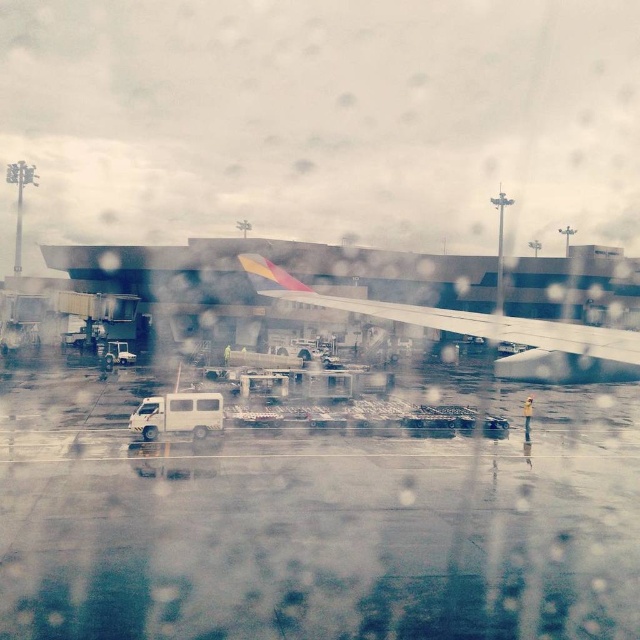
Does point (596, 352) lie in front of point (184, 408)?

That is True.

Can you confirm if metallic silver wing at center is thinner than transparent glass airplane window at center?

No.

Between point (481, 323) and point (184, 404), which one is positioned in front?

Point (481, 323)

Locate an element on the screen. metallic silver wing at center is located at coordinates (483, 332).

Which of these two, white matte van at center or white glossy van at center, stands taller?

Standing taller between the two is white glossy van at center.

Between point (220, 404) and point (145, 406), which one is positioned in front?

Point (220, 404) is more forward.

Where is `white matte van at center`? The image size is (640, 640). white matte van at center is located at coordinates (208, 404).

Does white rubber tarmac at center have a smaller size compared to metallic silver wing at center?

Correct, white rubber tarmac at center occupies less space than metallic silver wing at center.

Who is positioned more to the left, white rubber tarmac at center or metallic silver wing at center?

metallic silver wing at center is more to the left.

Based on the photo, measure the distance between white rubber tarmac at center and camera.

white rubber tarmac at center and camera are 34.72 feet apart.

Identify the location of white rubber tarmac at center. (314, 525).